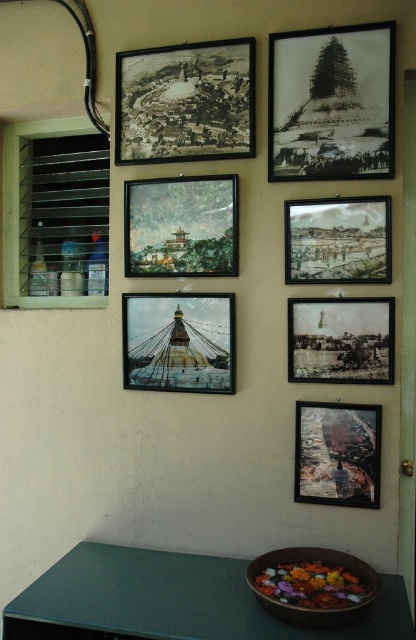
Can you confirm if green glossy table at lower left is shorter than matte paper painting at center?

Yes, green glossy table at lower left is shorter than matte paper painting at center.

Is green glossy table at lower left bigger than matte paper painting at center?

Correct, green glossy table at lower left is larger in size than matte paper painting at center.

This screenshot has height=640, width=416. What are the coordinates of `green glossy table at lower left` in the screenshot? It's located at (171, 600).

I want to click on black paper photograph at upper right, so click(x=331, y=104).

Looking at this image, does black paper photograph at upper right come in front of wooden textured painting at lower right?

Yes, it is in front of wooden textured painting at lower right.

Locate an element on the screen. This screenshot has width=416, height=640. black paper photograph at upper right is located at coordinates (x=331, y=104).

The height and width of the screenshot is (640, 416). Identify the location of black paper photograph at upper right. (331, 104).

Does green glossy table at lower left have a greater width compared to wooden textured painting at lower right?

Yes, green glossy table at lower left is wider than wooden textured painting at lower right.

Between point (270, 634) and point (364, 506), which one is positioned in front?

Point (270, 634) is in front.

Locate an element on the screen. Image resolution: width=416 pixels, height=640 pixels. green glossy table at lower left is located at coordinates (171, 600).